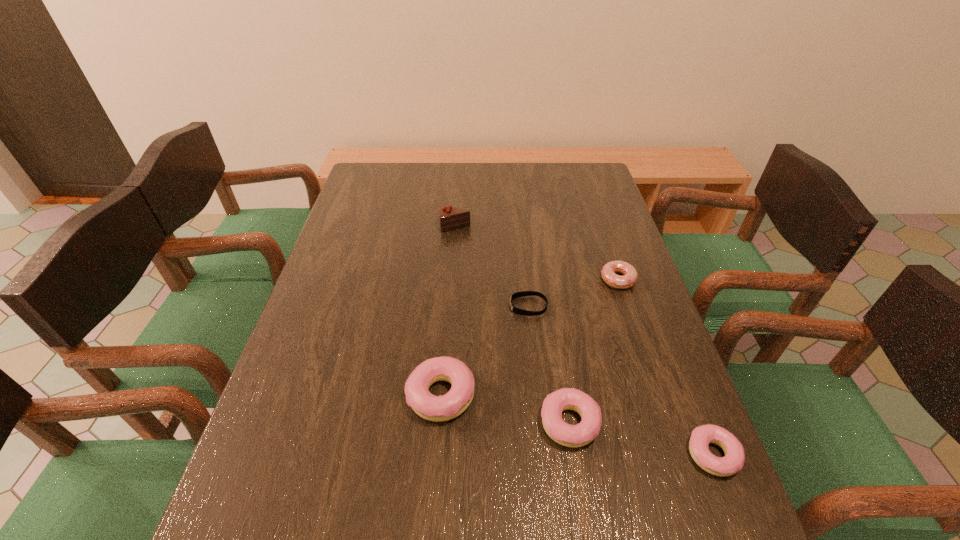
Locate an element on the screen. free space located on the back of the fourth shortest object is located at coordinates (551, 306).

Locate an element on the screen. This screenshot has height=540, width=960. vacant space located on the left of the farthest doughnut is located at coordinates (503, 280).

You are a GUI agent. You are given a task and a screenshot of the screen. Output one action in this format:
    pyautogui.click(x=<x>, y=<y>)
    Task: Click on the vacant point located on the right of the tallest object
    This screenshot has height=540, width=960.
    Given the screenshot: What is the action you would take?
    pyautogui.click(x=564, y=226)

Locate an element on the screen. This screenshot has width=960, height=540. free spot located 0.280m on the display of the shortest object is located at coordinates (402, 306).

Find the location of a particular element. The height and width of the screenshot is (540, 960). vacant space located 0.070m on the display of the shortest object is located at coordinates (483, 306).

Locate an element on the screen. The width and height of the screenshot is (960, 540). free space located 0.350m on the display of the shortest object is located at coordinates (375, 306).

Locate an element on the screen. The image size is (960, 540). object at the near edge is located at coordinates (701, 436).

Where is `object located at the near right corner`? The image size is (960, 540). object located at the near right corner is located at coordinates (701, 436).

This screenshot has width=960, height=540. In the image, there is a desktop. In order to click on free region at the far edge in this screenshot , I will do `click(547, 192)`.

In order to click on blank space at the left edge of the desktop in this screenshot , I will do coord(386,203).